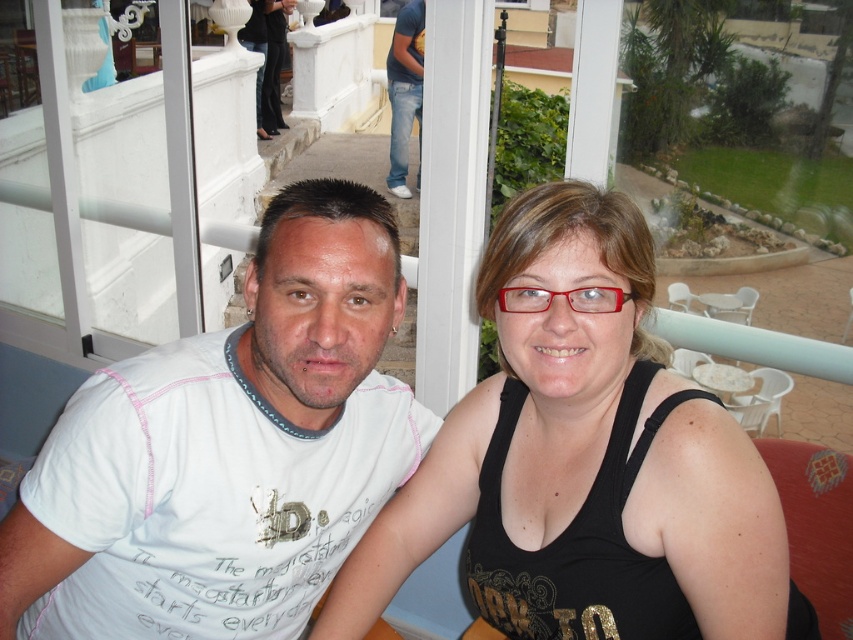
Question: Is white cotton t-shirt at left behind black matte tank top at center?

Choices:
 (A) yes
 (B) no

Answer: (B)

Question: Is white cotton t-shirt at left bigger than black matte tank top at center?

Choices:
 (A) yes
 (B) no

Answer: (A)

Question: Does white cotton t-shirt at left lie behind black matte tank top at center?

Choices:
 (A) yes
 (B) no

Answer: (B)